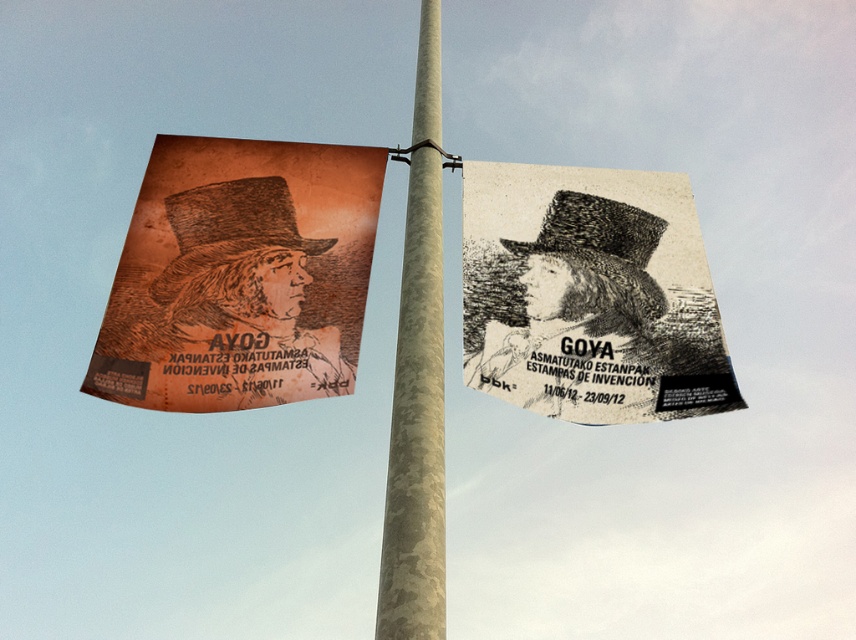
Is orange paper poster at left below black textured paper at upper right?

Actually, orange paper poster at left is above black textured paper at upper right.

Who is positioned more to the left, orange paper poster at left or black textured paper at upper right?

Positioned to the left is orange paper poster at left.

Is point (305, 211) more distant than point (510, 317)?

Yes.

This screenshot has width=856, height=640. Find the location of `orange paper poster at left`. orange paper poster at left is located at coordinates (241, 275).

Which is more to the left, orange paper poster at left or camouflage pole at center?

orange paper poster at left is more to the left.

Find the location of a particular element. orange paper poster at left is located at coordinates (241, 275).

Which is above, black textured paper at upper right or camouflage pole at center?

camouflage pole at center is higher up.

Which is in front, point (617, 244) or point (437, 288)?

Point (437, 288)

The height and width of the screenshot is (640, 856). I want to click on black textured paper at upper right, so click(x=590, y=294).